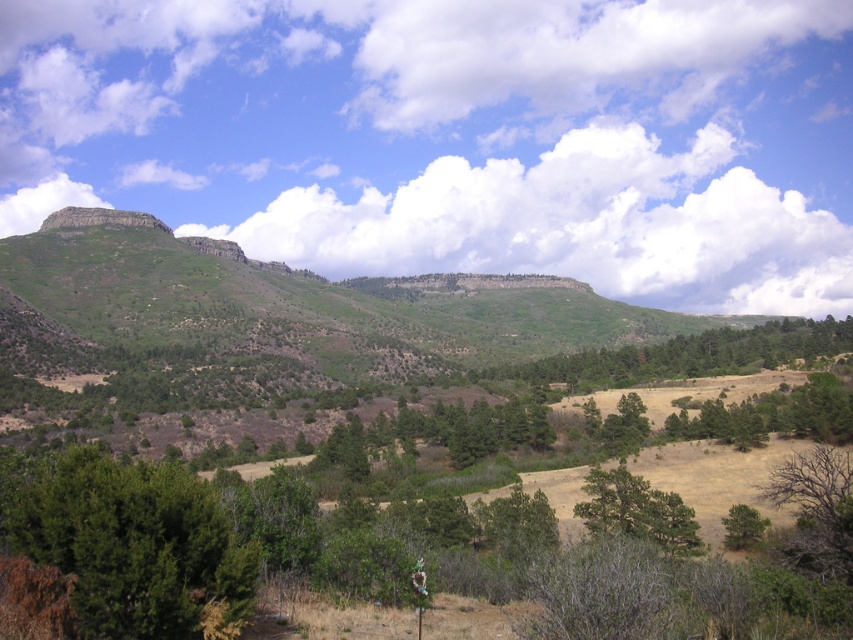
Question: Is dark green textured tree at lower left bigger than green matte tree at center?

Choices:
 (A) no
 (B) yes

Answer: (A)

Question: Which object is positioned closest to the dark green textured tree at lower left?

Choices:
 (A) green matte tree at center
 (B) green matte tree at lower right

Answer: (A)

Question: Which point is farther to the camera?

Choices:
 (A) dark green textured tree at lower left
 (B) green matte tree at center
 (C) green matte tree at lower right

Answer: (C)

Question: Does green matte tree at center have a lesser width compared to green matte tree at lower right?

Choices:
 (A) no
 (B) yes

Answer: (A)

Question: Is the position of dark green textured tree at lower left less distant than that of green matte tree at lower right?

Choices:
 (A) yes
 (B) no

Answer: (A)

Question: Which is farther from the green matte tree at center?

Choices:
 (A) green matte tree at lower right
 (B) dark green textured tree at lower left

Answer: (B)